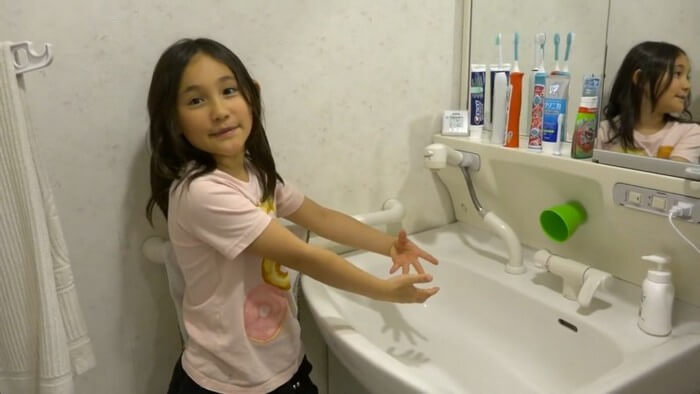
This screenshot has height=394, width=700. I want to click on towel hanger, so click(x=34, y=65).